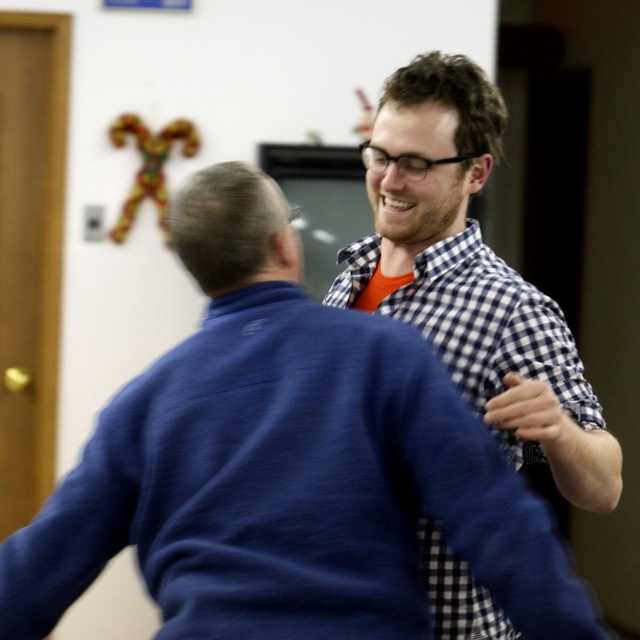
Does checkered fabric shirt at upper right have a greater width compared to white checkered shirt at right?

Correct, the width of checkered fabric shirt at upper right exceeds that of white checkered shirt at right.

Can you confirm if checkered fabric shirt at upper right is positioned below white checkered shirt at right?

Correct, checkered fabric shirt at upper right is located below white checkered shirt at right.

Between point (275, 632) and point (378, 252), which one is positioned in front?

Point (275, 632) is more forward.

The image size is (640, 640). Find the location of `checkered fabric shirt at upper right`. checkered fabric shirt at upper right is located at coordinates (285, 465).